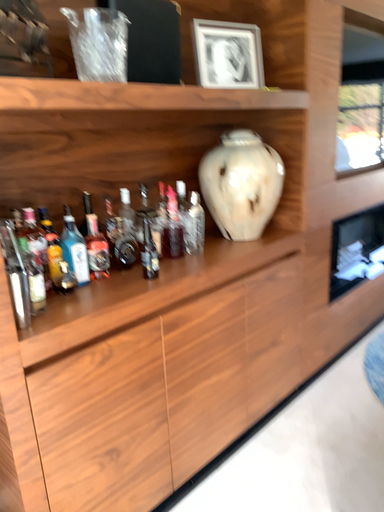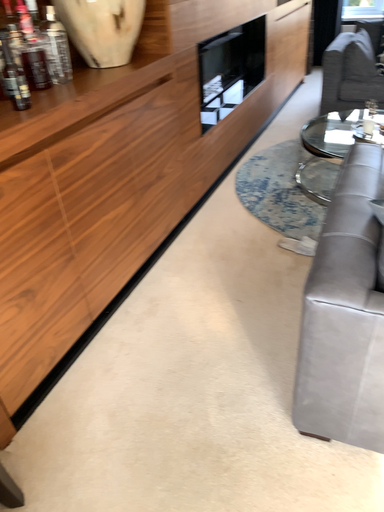
Question: How did the camera likely rotate when shooting the video?

Choices:
 (A) rotated upward
 (B) rotated downward

Answer: (B)